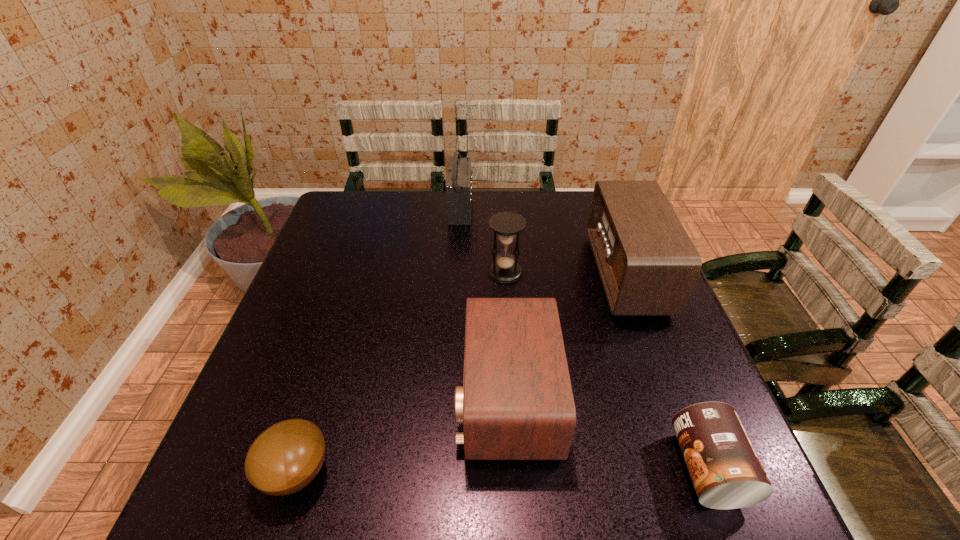
Image resolution: width=960 pixels, height=540 pixels. What are the coordinates of `vacant space situated on the back of the leftmost object` in the screenshot? It's located at (328, 370).

The image size is (960, 540). In order to click on object that is positioned at the far edge in this screenshot , I will do `click(459, 185)`.

What are the coordinates of `can at the near edge` in the screenshot? It's located at (725, 470).

Locate an element on the screen. bowl present at the near edge is located at coordinates (286, 457).

The height and width of the screenshot is (540, 960). Identify the location of object at the left edge. (286, 457).

Where is `radio receiver present at the right edge`? The image size is (960, 540). radio receiver present at the right edge is located at coordinates (648, 265).

Identify the location of can positioned at the right edge. (725, 470).

The height and width of the screenshot is (540, 960). Find the location of `object located at the near left corner`. object located at the near left corner is located at coordinates (286, 457).

Where is `object that is at the near right corner`? The width and height of the screenshot is (960, 540). object that is at the near right corner is located at coordinates (725, 470).

Where is `free region at the far edge of the desktop`? The image size is (960, 540). free region at the far edge of the desktop is located at coordinates (517, 193).